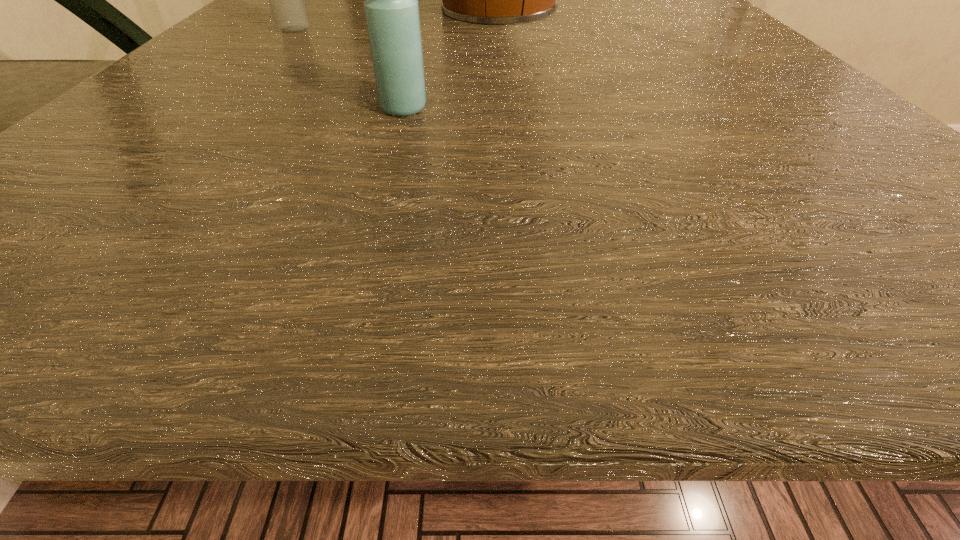
Find the location of a particular element. object that is at the right edge is located at coordinates (747, 0).

Where is `free space at the near edge of the desktop`? The height and width of the screenshot is (540, 960). free space at the near edge of the desktop is located at coordinates [620, 254].

In the image, there is a desktop. In order to click on vacant space at the left edge in this screenshot , I will do `click(163, 194)`.

At what (x,y) coordinates should I click in order to perform the action: click on vacant space at the right edge of the desktop. Please return your answer as a coordinate pair (x, y). The image size is (960, 540). Looking at the image, I should click on (695, 96).

In the image, there is a desktop. Find the location of `free space at the far right corner`. free space at the far right corner is located at coordinates (678, 3).

In the image, there is a desktop. Where is `blank space at the near right corner`? The width and height of the screenshot is (960, 540). blank space at the near right corner is located at coordinates (900, 242).

This screenshot has height=540, width=960. Find the location of `blank region between the tallest water bottle and the rightmost water bottle`. blank region between the tallest water bottle and the rightmost water bottle is located at coordinates (511, 44).

Image resolution: width=960 pixels, height=540 pixels. In order to click on vacant space that is in between the nearest water bottle and the leftmost water bottle in this screenshot , I will do [348, 69].

Locate an element on the screen. The image size is (960, 540). vacant space in between the tallest water bottle and the third farthest object is located at coordinates (511, 44).

The width and height of the screenshot is (960, 540). I want to click on free spot between the rightmost object and the second water bottle from right to left, so click(565, 83).